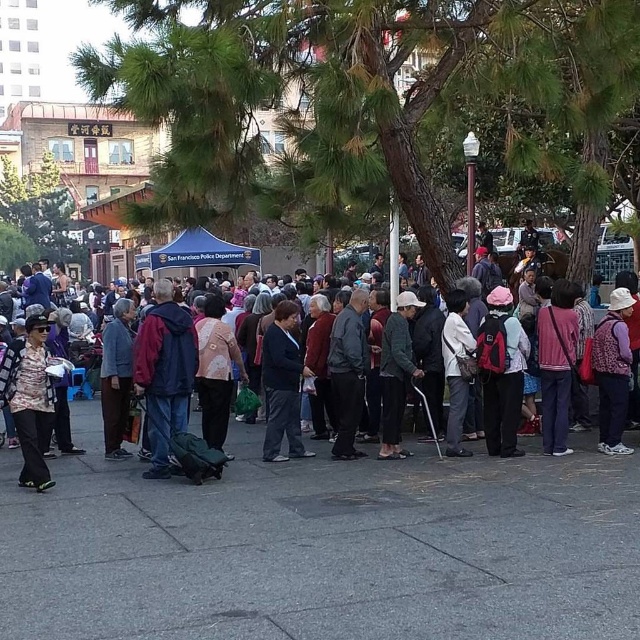
You are standing in the middle of the crowd at the event and see two points marked in the scene. Which point, point (x=266, y=374) or point (x=609, y=316), is closer to you?

Point (x=266, y=374) is closer to you because it is further to the viewer than point (x=609, y=316).

You are standing at the camera position and want to throw a frisbee to a friend. There are two points in the scene where you could aim. The first is point (x=460, y=500) and the second is point (x=164, y=365). Which point should you aim for if you want the frisbee to land closer to you?

You should aim for point (x=460, y=500) because it is closer to the camera than point (x=164, y=365).